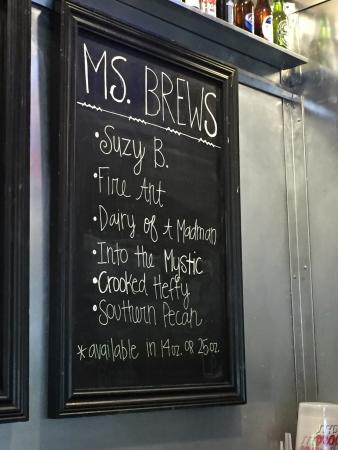
Identify the location of shelf. (235, 33).